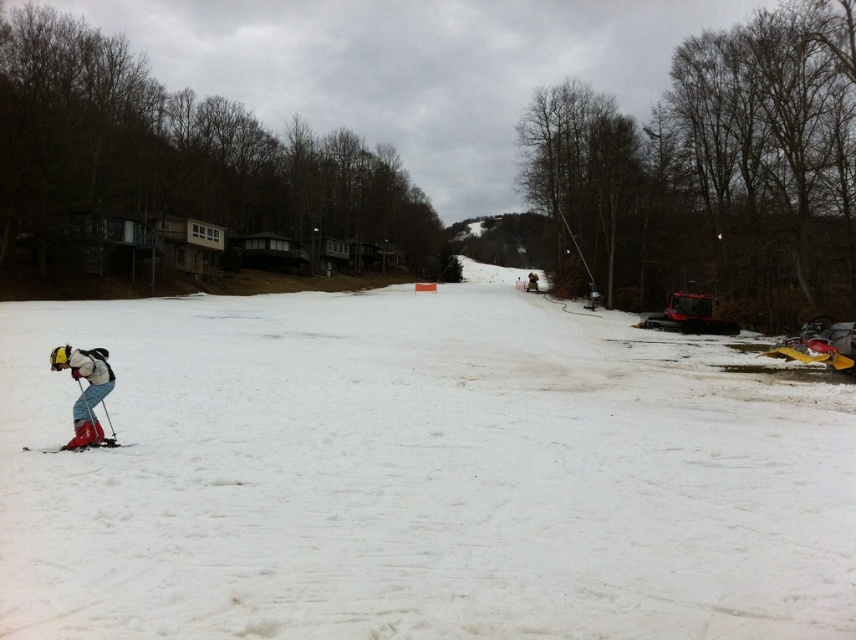
Does point (655, 604) come farther from viewer compared to point (98, 442)?

No, it is in front of (98, 442).

Is white powdery snow at center above matte red ski at lower left?

Yes, white powdery snow at center is above matte red ski at lower left.

Which is in front, point (572, 616) or point (49, 451)?

Point (572, 616) is in front.

Where is `white powdery snow at center`? white powdery snow at center is located at coordinates (417, 474).

Is matte red ski suit at lower left further to camera compared to matte red ski at lower left?

Yes, it is behind matte red ski at lower left.

Which is behind, point (75, 422) or point (122, 444)?

Point (122, 444)

Locate an element on the screen. This screenshot has height=640, width=856. matte red ski suit at lower left is located at coordinates (85, 388).

Find the location of `matte red ski suit at lower left`. matte red ski suit at lower left is located at coordinates (85, 388).

Is white powdery snow at center wider than matte red ski suit at lower left?

Yes.

Is white powdery snow at center positioned behind matte red ski suit at lower left?

No, it is in front of matte red ski suit at lower left.

Find the location of a particular element. The width and height of the screenshot is (856, 640). white powdery snow at center is located at coordinates (417, 474).